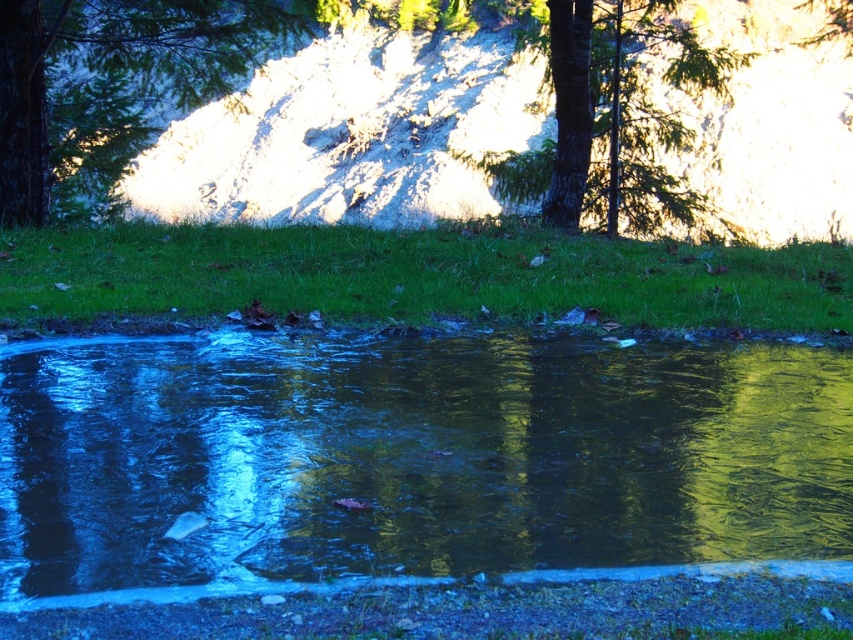
You are standing at the edge of the water and see two points marked in the scene. Which point, point (312, 538) or point (647, 173), is closer to you?

Point (312, 538) is closer to the viewer than point (647, 173).

You are standing at the edge of the water and see two points marked in the scene. The first point is at coordinate point(15, 77) and the second point is at point(521, 33). Which point is closer to you?

Point(15, 77) is in front of point(521, 33), so the first point is closer to you.